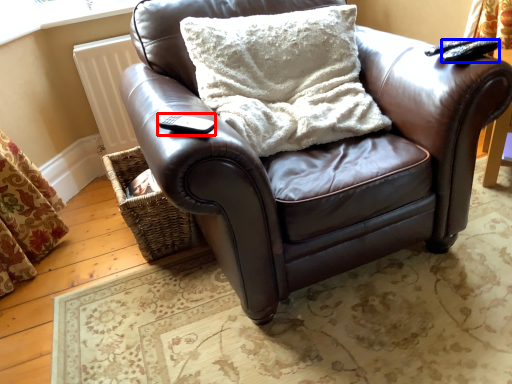
Question: Which object appears closest to the camera in this image, remote (highlighted by a red box) or remote (highlighted by a blue box)?

Choices:
 (A) remote
 (B) remote

Answer: (A)